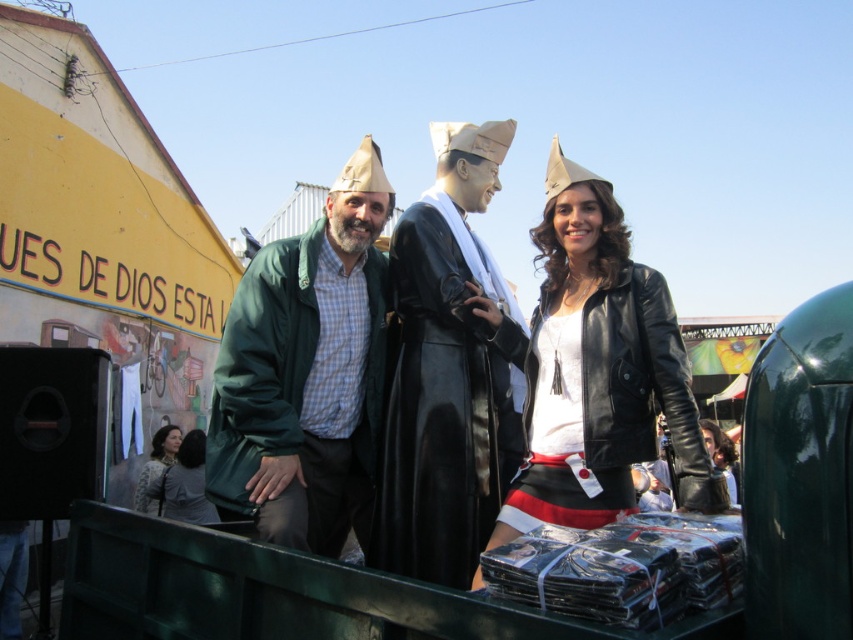
Question: Which object is the closest to the green matte jacket at center?

Choices:
 (A) light brown textured coat at lower left
 (B) leather jacket at center
 (C) matte black coat at center

Answer: (C)

Question: Is shiny black coat at center positioned in front of leather jacket at center?

Choices:
 (A) yes
 (B) no

Answer: (A)

Question: Can you confirm if leather jacket at center is positioned to the right of light brown textured coat at lower left?

Choices:
 (A) no
 (B) yes

Answer: (B)

Question: Is the position of green matte jacket at center more distant than that of light brown textured coat at lower left?

Choices:
 (A) yes
 (B) no

Answer: (B)

Question: Which of the following is the closest to the observer?

Choices:
 (A) (405, 392)
 (B) (297, 467)
 (C) (144, 512)
 (D) (715, 440)

Answer: (B)

Question: Which of the following is the farthest from the observer?

Choices:
 (A) (473, 547)
 (B) (721, 465)
 (C) (219, 419)

Answer: (B)